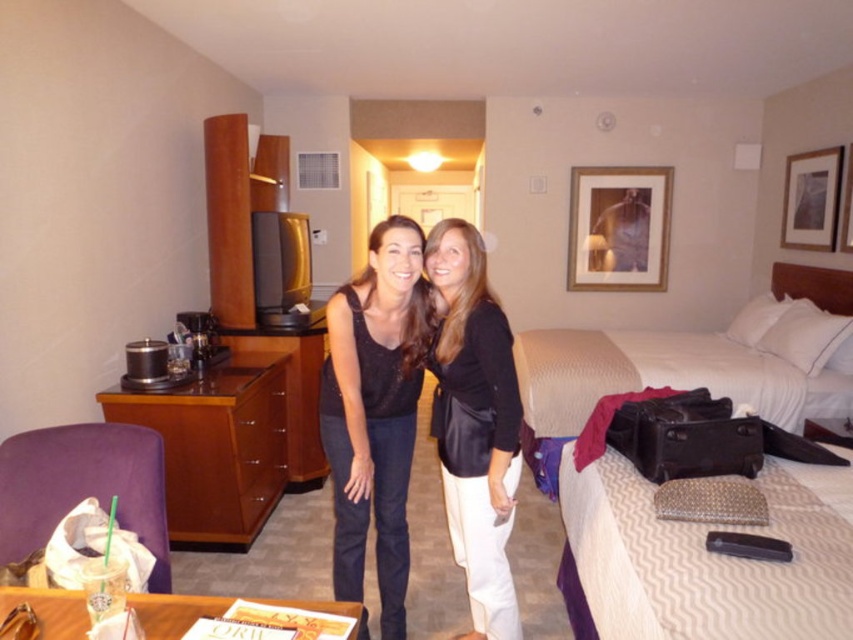
Question: Which object is positioned closest to the black leather jacket at center?

Choices:
 (A) matte black tank top at center
 (B) white textured bed at center

Answer: (A)

Question: Which point is closer to the camera?

Choices:
 (A) matte black tank top at center
 (B) black leather jacket at center

Answer: (B)

Question: Which of these objects is positioned farthest from the white textured bed at center?

Choices:
 (A) matte black tank top at center
 (B) black leather jacket at center

Answer: (A)

Question: Where is matte black tank top at center located in relation to black leather jacket at center in the image?

Choices:
 (A) left
 (B) right

Answer: (A)

Question: Is black leather jacket at center behind white textured bed at center?

Choices:
 (A) no
 (B) yes

Answer: (A)

Question: Is black leather jacket at center above white textured bed at center?

Choices:
 (A) no
 (B) yes

Answer: (A)